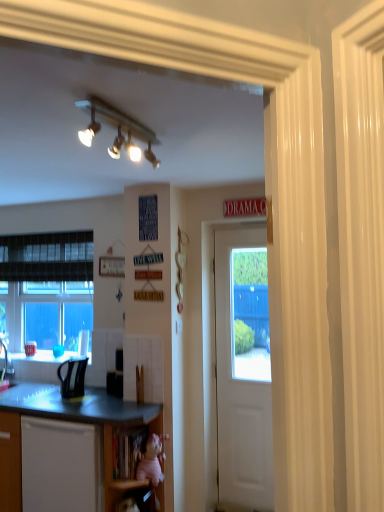
Find the location of `free space above white glossy track lights at upper center (from a real-world perspective)`. free space above white glossy track lights at upper center (from a real-world perspective) is located at coordinates (116, 112).